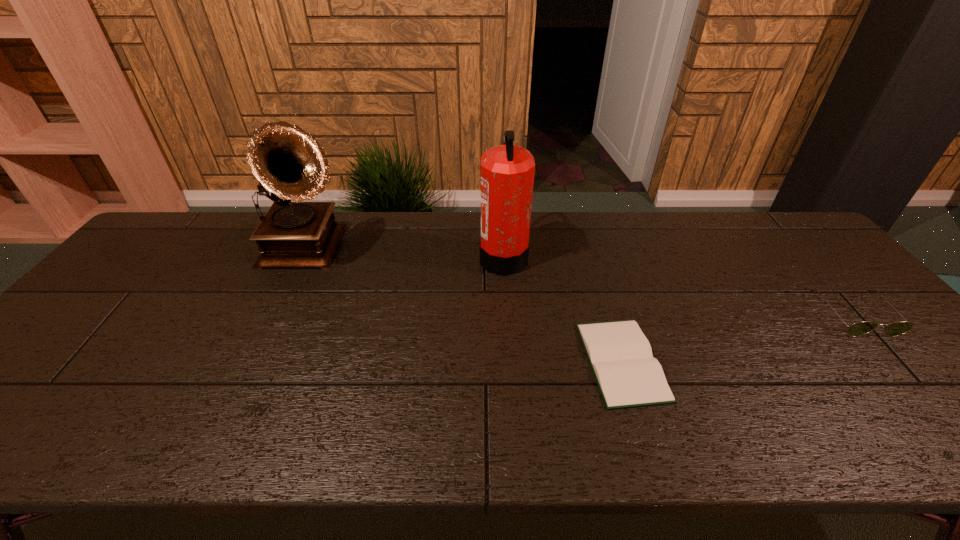
You are a GUI agent. You are given a task and a screenshot of the screen. Output one action in this format:
    pyautogui.click(x=<x>, y=<y>)
    Task: Click on the second object from left to right
    The width and height of the screenshot is (960, 540).
    Given the screenshot: What is the action you would take?
    pyautogui.click(x=507, y=171)

Identify the location of the leftmost object. The image size is (960, 540). point(288,162).

What are the coordinates of `the second shortest object` in the screenshot? It's located at [x=856, y=329].

The image size is (960, 540). In order to click on the rightmost object in this screenshot , I will do point(856,329).

Identify the location of the second object from right to left. (628, 376).

What are the coordinates of `hardback book` in the screenshot? It's located at (628, 376).

You are a GUI agent. You are given a task and a screenshot of the screen. Output one action in this format:
    pyautogui.click(x=<x>, y=<y>)
    Task: Click on the free spot located on the front side of the fire extinguisher
    The image size is (960, 540).
    Given the screenshot: What is the action you would take?
    pyautogui.click(x=411, y=256)

The width and height of the screenshot is (960, 540). I want to click on free space located 0.240m on the front side of the fire extinguisher, so click(x=401, y=256).

Where is `free space located on the front side of the fire extinguisher`? The width and height of the screenshot is (960, 540). free space located on the front side of the fire extinguisher is located at coordinates (397, 256).

Locate an element on the screen. The image size is (960, 540). vacant region located 0.160m on the horn of the leftmost object is located at coordinates (402, 251).